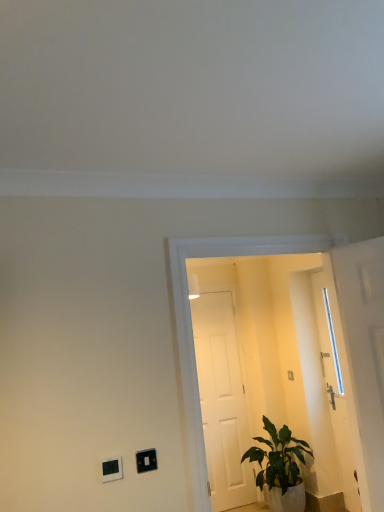
Question: Does transparent glass door at center have a greater height compared to green leafy plant at lower right?

Choices:
 (A) no
 (B) yes

Answer: (B)

Question: Is transparent glass door at center beside green leafy plant at lower right?

Choices:
 (A) yes
 (B) no

Answer: (B)

Question: Is transparent glass door at center oriented away from green leafy plant at lower right?

Choices:
 (A) no
 (B) yes

Answer: (B)

Question: Is transparent glass door at center smaller than green leafy plant at lower right?

Choices:
 (A) no
 (B) yes

Answer: (A)

Question: Is transparent glass door at center shorter than green leafy plant at lower right?

Choices:
 (A) no
 (B) yes

Answer: (A)

Question: From a real-world perspective, is transparent glass door at center physically below green leafy plant at lower right?

Choices:
 (A) no
 (B) yes

Answer: (A)

Question: Would you say black plastic light switch at lower left, the 1th light switch positioned from the front, contains transparent glass door at center?

Choices:
 (A) yes
 (B) no

Answer: (B)

Question: Does black plastic light switch at lower left, positioned as the 2th light switch in back-to-front order, have a greater height compared to transparent glass door at center?

Choices:
 (A) yes
 (B) no

Answer: (B)

Question: Is black plastic light switch at lower left, which ranks as the 2th light switch in right-to-left order, thinner than transparent glass door at center?

Choices:
 (A) yes
 (B) no

Answer: (A)

Question: Is black plastic light switch at lower left, the first light switch viewed from the left, looking in the opposite direction of transparent glass door at center?

Choices:
 (A) yes
 (B) no

Answer: (B)

Question: Does black plastic light switch at lower left, the first light switch viewed from the left, come behind transparent glass door at center?

Choices:
 (A) yes
 (B) no

Answer: (B)

Question: Considering the relative positions of black plastic light switch at lower left, which ranks as the 2th light switch in right-to-left order, and transparent glass door at center in the image provided, is black plastic light switch at lower left, which ranks as the 2th light switch in right-to-left order, to the right of transparent glass door at center from the viewer's perspective?

Choices:
 (A) no
 (B) yes

Answer: (A)

Question: From the image's perspective, is black plastic light switch at lower left, positioned as the 2th light switch in back-to-front order, on green leafy plant at lower right?

Choices:
 (A) no
 (B) yes

Answer: (B)